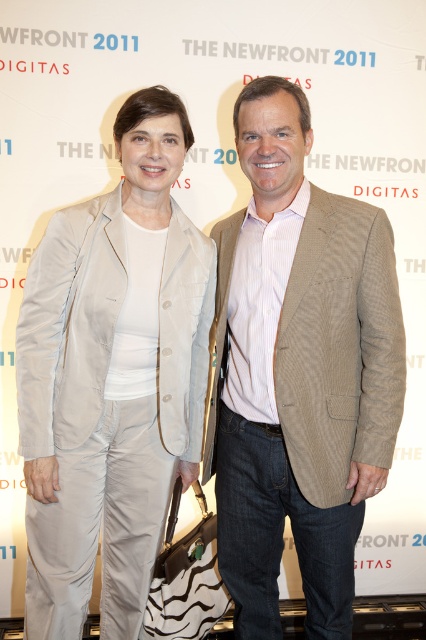
Question: Does light beige satin suit at center have a greater width compared to beige corduroy blazer at center?

Choices:
 (A) no
 (B) yes

Answer: (B)

Question: Among these objects, which one is nearest to the camera?

Choices:
 (A) beige corduroy blazer at center
 (B) light beige satin suit at center

Answer: (A)

Question: Is light beige satin suit at center to the right of beige corduroy blazer at center from the viewer's perspective?

Choices:
 (A) no
 (B) yes

Answer: (A)

Question: Which point is closer to the camera?

Choices:
 (A) (313, 468)
 (B) (77, 216)

Answer: (A)

Question: Is light beige satin suit at center further to camera compared to beige corduroy blazer at center?

Choices:
 (A) yes
 (B) no

Answer: (A)